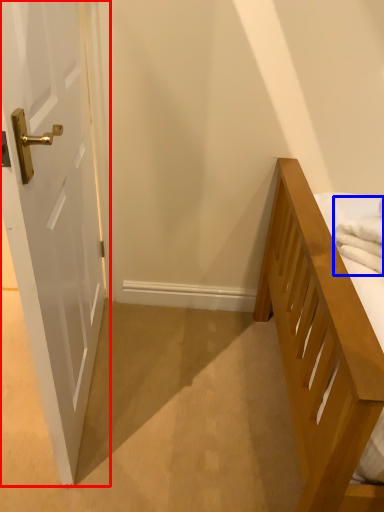
Question: Among these objects, which one is nearest to the camera, door (highlighted by a red box) or bath towel (highlighted by a blue box)?

Choices:
 (A) door
 (B) bath towel

Answer: (A)